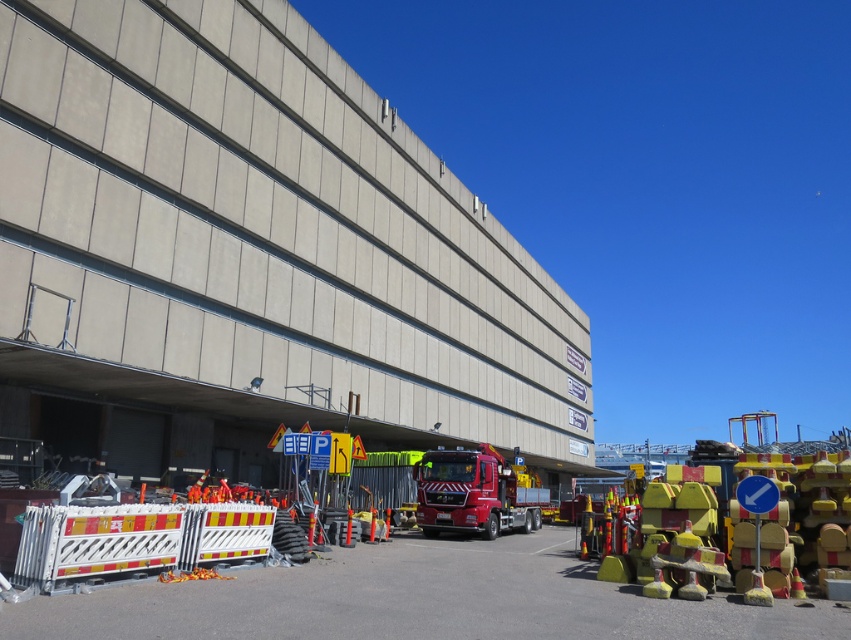
Question: Is yellow rubber cones at lower right positioned behind white plastic barricade at lower left?

Choices:
 (A) no
 (B) yes

Answer: (A)

Question: Does white plastic barricade at lower left have a smaller size compared to shiny red fire truck at center?

Choices:
 (A) no
 (B) yes

Answer: (B)

Question: Is concrete building at center positioned before white plastic barricade at lower left?

Choices:
 (A) no
 (B) yes

Answer: (A)

Question: Among these points, which one is nearest to the camera?

Choices:
 (A) (134, 525)
 (B) (463, 508)

Answer: (A)

Question: Which object is positioned farthest from the yellow rubber cones at lower right?

Choices:
 (A) concrete building at center
 (B) shiny red fire truck at center

Answer: (A)

Question: Which point appears closest to the camera in this image?

Choices:
 (A) (158, 548)
 (B) (578, 605)
 (C) (488, 508)

Answer: (B)